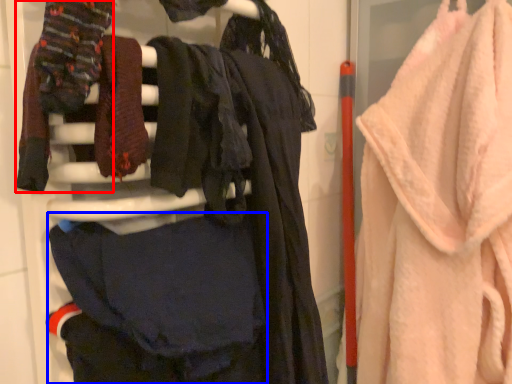
Question: Which object appears closest to the camera in this image, clothing (highlighted by a red box) or clothing (highlighted by a blue box)?

Choices:
 (A) clothing
 (B) clothing

Answer: (A)